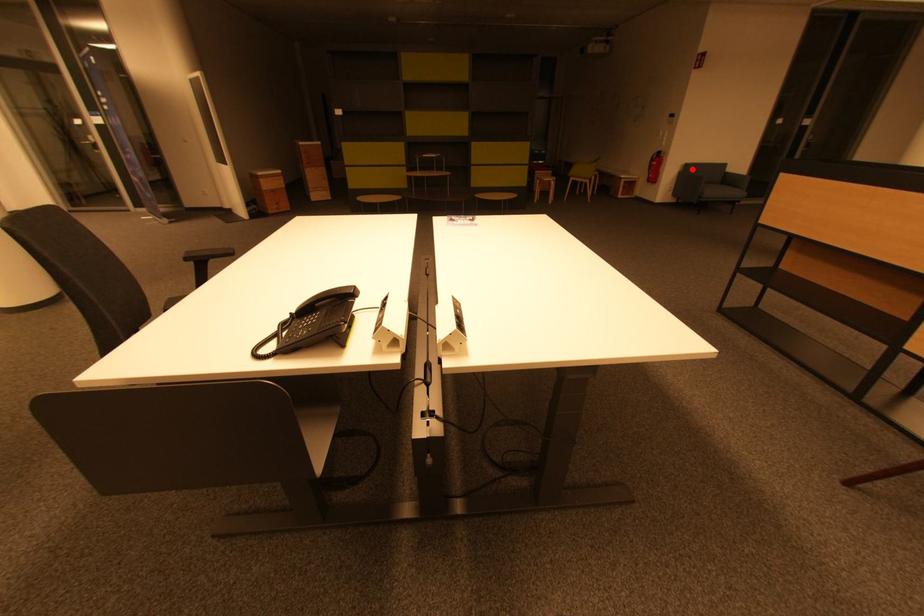
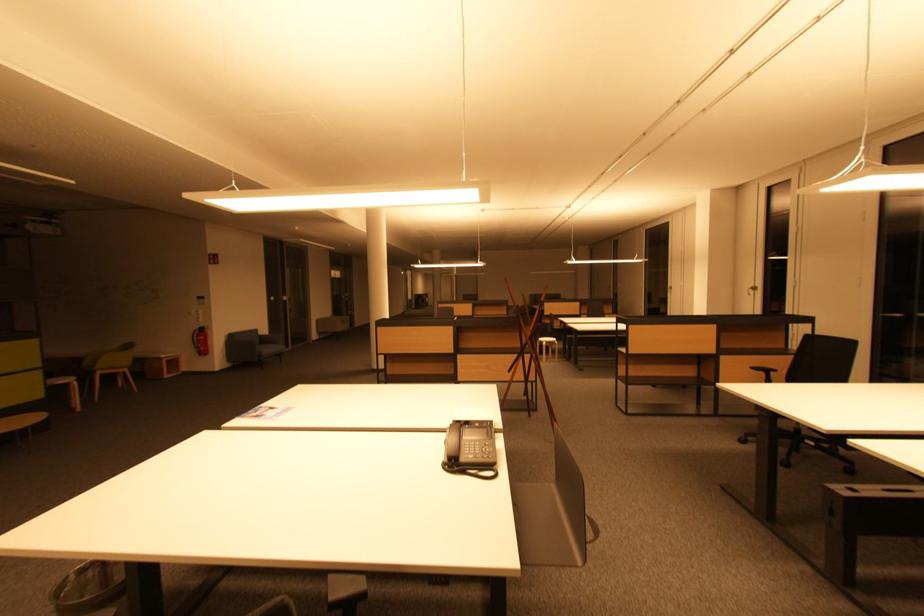
Question: I am providing you with two images of the same scene from different viewpoints. A red point is shown in image1. For the corresponding object point in image2, is it positioned nearer or farther from the camera?

Choices:
 (A) Nearer
 (B) Farther

Answer: (B)